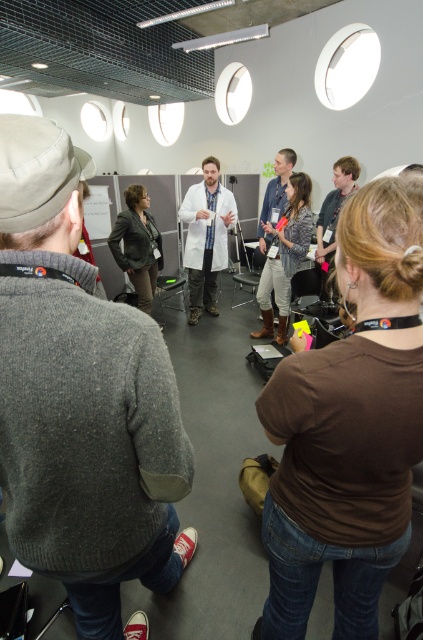
Does gray wool sweater at center have a greater height compared to light brown leather jacket at center?

Correct, gray wool sweater at center is much taller as light brown leather jacket at center.

Does gray wool sweater at center have a greater width compared to light brown leather jacket at center?

Yes.

Does point (90, 515) come behind point (324, 257)?

No.

The height and width of the screenshot is (640, 423). Find the location of `gray wool sweater at center`. gray wool sweater at center is located at coordinates (80, 397).

From the picture: Who is positioned more to the left, gray wool sweater at center or dark gray blazer at center?

dark gray blazer at center is more to the left.

Between point (10, 131) and point (128, 224), which one is positioned in front?

Point (10, 131)

Does point (79, 467) lie behind point (148, 221)?

No, (79, 467) is in front of (148, 221).

At what (x,y) coordinates should I click in order to perform the action: click on gray wool sweater at center. Please return your answer as a coordinate pair (x, y). Looking at the image, I should click on (80, 397).

Does brown cotton shirt at center have a lesser width compared to light brown leather jacket at center?

In fact, brown cotton shirt at center might be wider than light brown leather jacket at center.

Does brown cotton shirt at center have a greater height compared to light brown leather jacket at center?

Indeed, brown cotton shirt at center has a greater height compared to light brown leather jacket at center.

Which is behind, point (373, 236) or point (348, 156)?

The point (348, 156) is more distant.

Locate an element on the screen. This screenshot has width=423, height=640. brown cotton shirt at center is located at coordinates (348, 429).